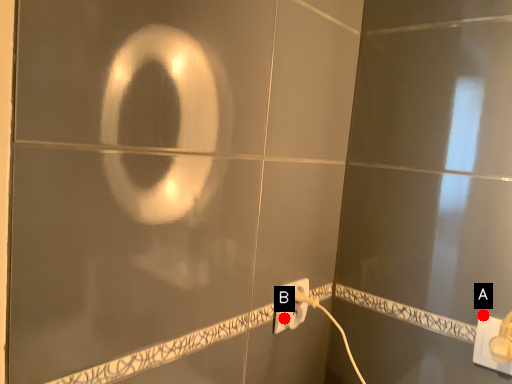
Question: Two points are circled on the image, labeled by A and B beside each circle. Which of the following is the closest to the observer?

Choices:
 (A) A is closer
 (B) B is closer

Answer: (A)